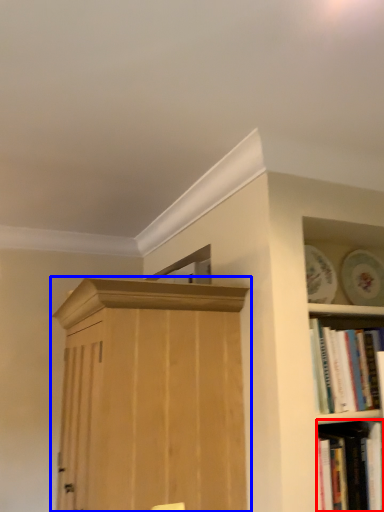
Question: Which object is closer to the camera taking this photo, book (highlighted by a red box) or cupboard (highlighted by a blue box)?

Choices:
 (A) book
 (B) cupboard

Answer: (B)